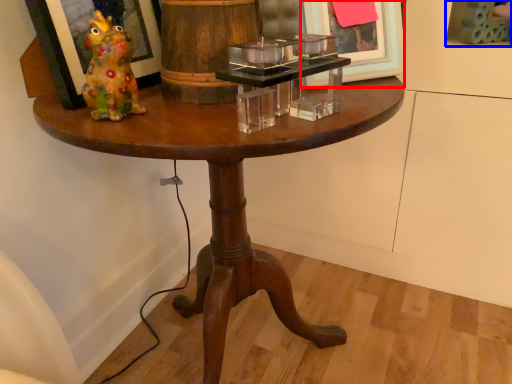
Question: Which object is closer to the camera taking this photo, picture frame (highlighted by a red box) or picture frame (highlighted by a blue box)?

Choices:
 (A) picture frame
 (B) picture frame

Answer: (A)